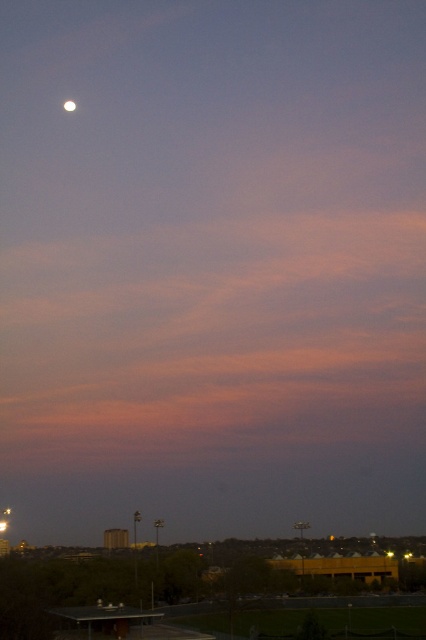
Who is taller, metallic gray stadium lights at lower center or silvery reflective moon at upper left?

metallic gray stadium lights at lower center

Can you confirm if metallic gray stadium lights at lower center is positioned below silvery reflective moon at upper left?

Yes.

You are a GUI agent. You are given a task and a screenshot of the screen. Output one action in this format:
    pyautogui.click(x=<x>, y=<y>)
    Task: Click on the metallic gray stadium lights at lower center
    The height and width of the screenshot is (640, 426).
    Given the screenshot: What is the action you would take?
    pyautogui.click(x=157, y=577)

Locate an element on the screen. metallic gray stadium lights at lower center is located at coordinates (157, 577).